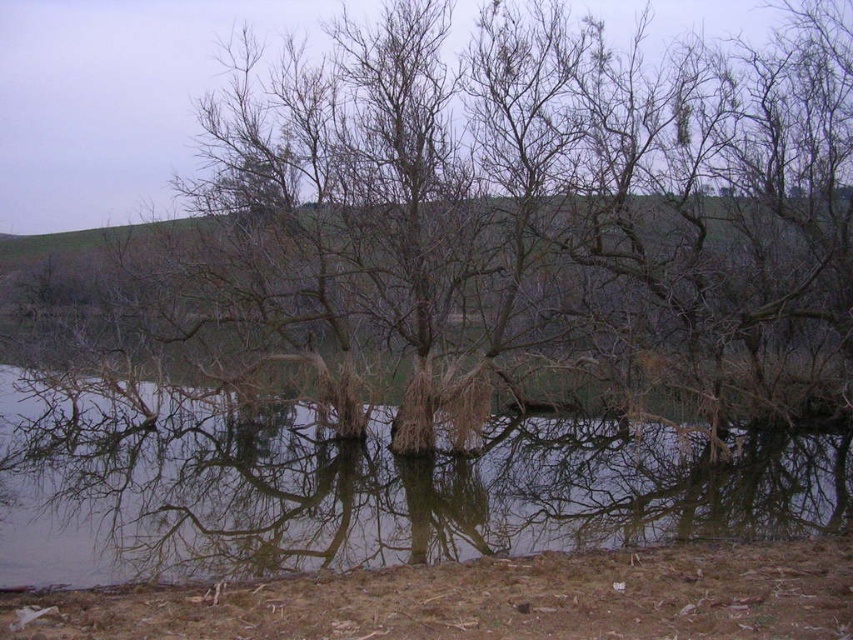
You are a drone operator trying to capture the reflection of the leafless trees in the transparent water at center. According to the coordinates, where should you position the drone to ensure the reflection is centered in your shot?

The transparent water at center is located at point (393,499), so positioning the drone at those coordinates will center the reflection of the leafless trees in the shot.